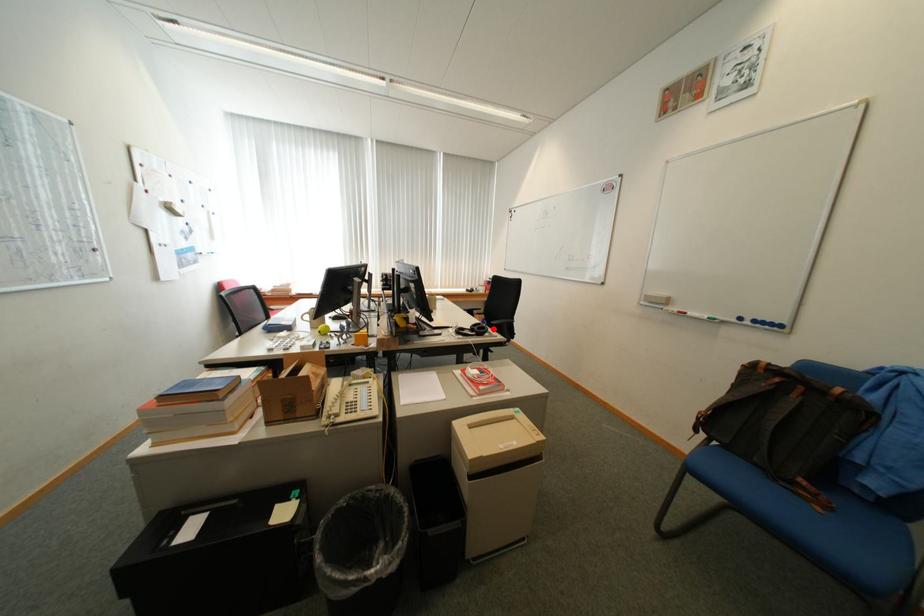
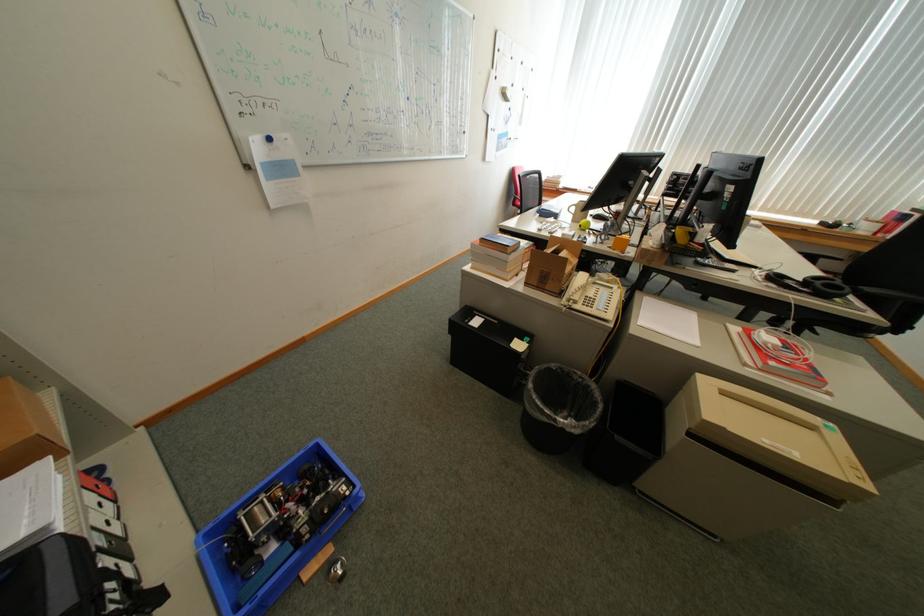
Where in the second image is the point corresponding to the highlighted location from the first image?

(849, 290)